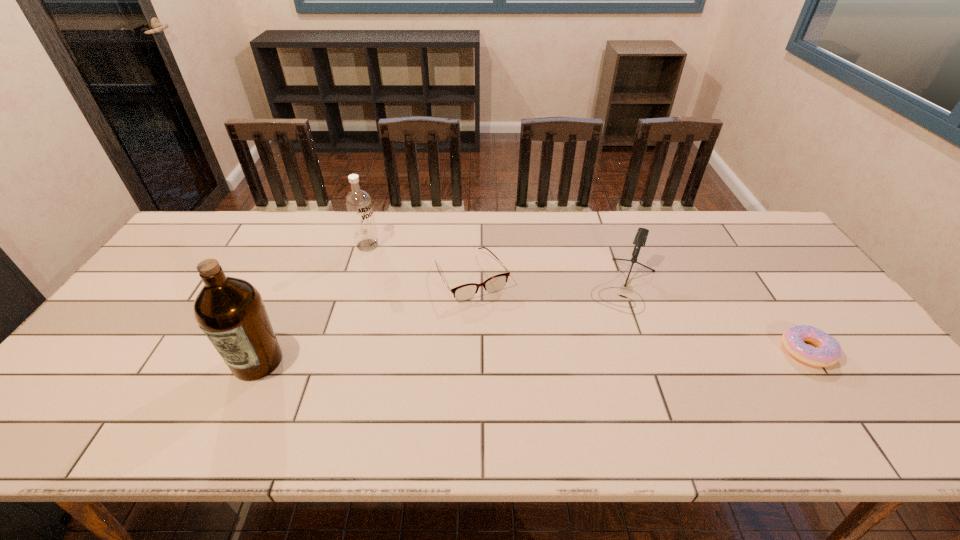
The image size is (960, 540). I want to click on free region located 0.050m on the label of the leftmost object, so click(238, 403).

I want to click on vacant space situated 0.220m on the back of the rightmost object, so click(756, 276).

Where is `vacant space located on the stand of the fourth object from left to right`? vacant space located on the stand of the fourth object from left to right is located at coordinates (590, 376).

Locate an element on the screen. The image size is (960, 540). vacant space located on the stand of the fourth object from left to right is located at coordinates (595, 363).

Locate an element on the screen. vacant space located 0.240m on the stand of the fourth object from left to right is located at coordinates (590, 376).

Where is `free space located on the face of the fourth tallest object`? free space located on the face of the fourth tallest object is located at coordinates (502, 328).

At what (x,y) coordinates should I click in order to perform the action: click on free space located 0.160m on the face of the fourth tallest object. Please return your answer as a coordinate pair (x, y). The height and width of the screenshot is (540, 960). Looking at the image, I should click on (512, 345).

Where is `vacant space situated on the face of the fourth tallest object`? The image size is (960, 540). vacant space situated on the face of the fourth tallest object is located at coordinates (512, 345).

In order to click on vacant area situated on the front label of the second object from left to right in this screenshot , I will do `click(407, 273)`.

The height and width of the screenshot is (540, 960). What are the coordinates of `vacant space located on the front label of the second object from left to right` in the screenshot? It's located at (411, 276).